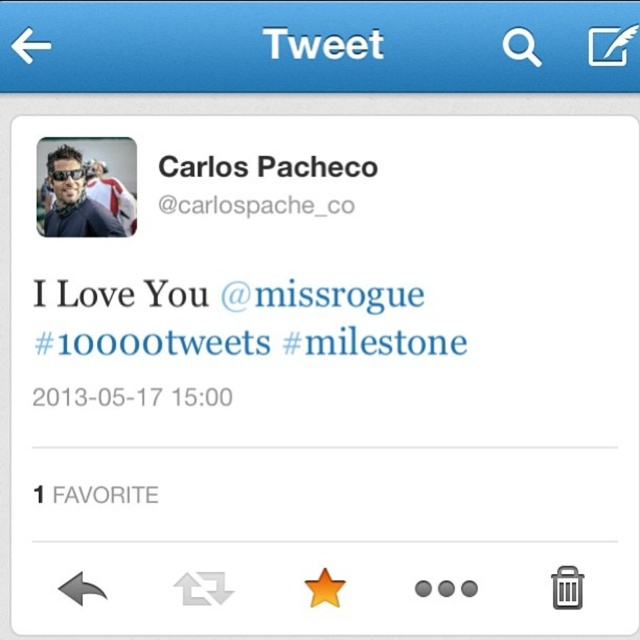
Based on the photo, you are a Twitter user trying to locate the sunglasses at upper left mentioned in the scene. Where exactly are they positioned on the screen?

The sunglasses at upper left are located at point coordinates of 0.312 on the x axis and 0.117 on the y axis.

You are looking at a tweet on your phone screen. You see the blue text tweet at center and the black text at upper center. Which one has bigger text?

The blue text tweet at center has a larger size compared to the black text at upper center.